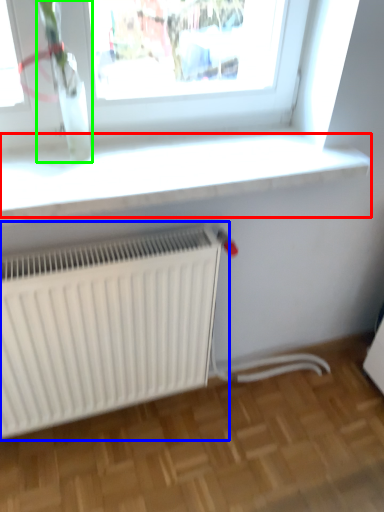
Question: Considering the real-world distances, which object is closest to window sill (highlighted by a red box)? radiator (highlighted by a blue box) or plant (highlighted by a green box).

Choices:
 (A) radiator
 (B) plant

Answer: (B)